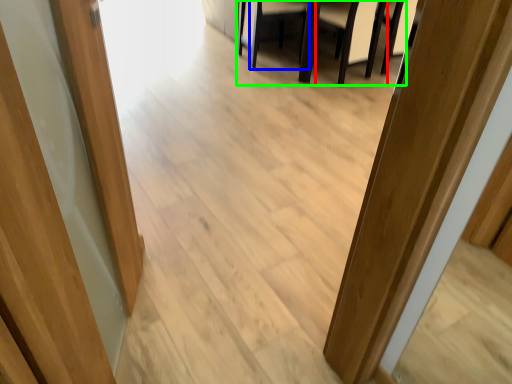
Question: Based on their relative distances, which object is nearer to armchair (highlighted by a red box)? Choose from armchair (highlighted by a blue box) and furniture (highlighted by a green box).

Choices:
 (A) armchair
 (B) furniture

Answer: (B)